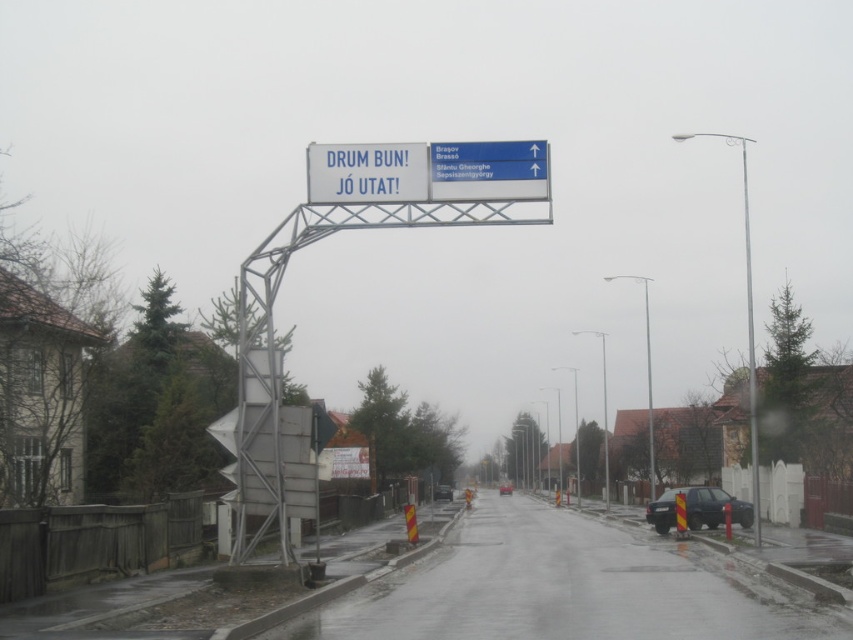
You are standing on the wet road and looking at the blue plastic sign at upper center and the metallic pole at right. Which object is nearer to you?

The blue plastic sign at upper center is closer to the viewer than the metallic pole at right.

You are a delivery driver who needs to navigate under the white plastic sign at upper center and the metallic pole at right. Based on the scene, which object is shorter and must be considered for clearance?

The white plastic sign at upper center is shorter than the metallic pole at right, so it is the one that must be considered for clearance as it has lower height.